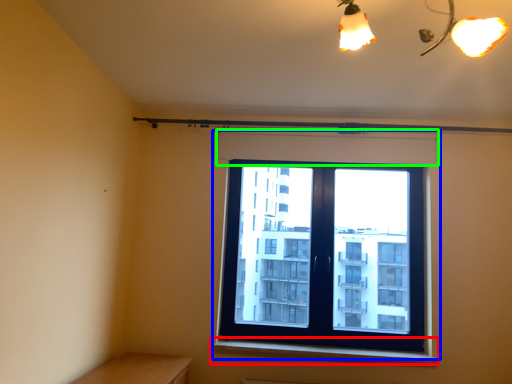
Question: Considering the real-world distances, which object is farthest from window sill (highlighted by a red box)? window (highlighted by a blue box) or shutter (highlighted by a green box)?

Choices:
 (A) window
 (B) shutter

Answer: (B)